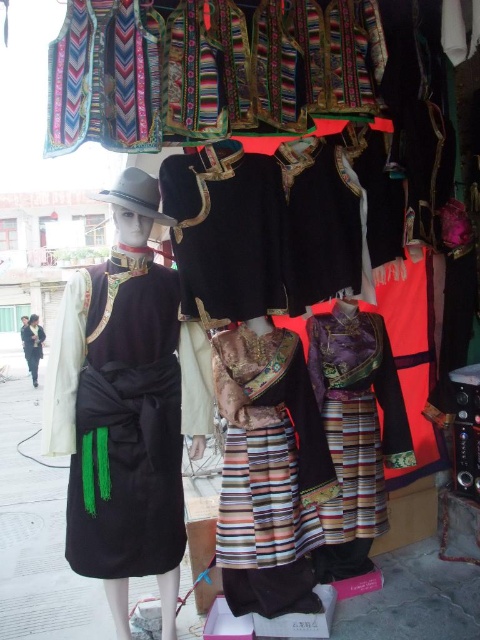
Is velvet black dress at center positioned at the back of velvet striped skirt at center?

No, velvet black dress at center is in front of velvet striped skirt at center.

Does velvet black dress at center have a greater width compared to velvet striped skirt at center?

Yes.

Is point (62, 321) farther from viewer compared to point (302, 528)?

No, (62, 321) is in front of (302, 528).

Identify the location of velvet black dress at center. (124, 410).

Does velvet striped skirt at center have a larger size compared to black velvet dress at left?

Actually, velvet striped skirt at center might be smaller than black velvet dress at left.

Is point (243, 448) farther from viewer compared to point (38, 333)?

No, (243, 448) is closer to viewer.

Identify the location of velvet striped skirt at center. The image size is (480, 640). (268, 472).

Does velvet black dress at center appear over black velvet dress at left?

Yes, velvet black dress at center is above black velvet dress at left.

Does point (119, 326) lie in front of point (26, 358)?

Yes, it is in front of point (26, 358).

Identify the location of velvet black dress at center. (124, 410).